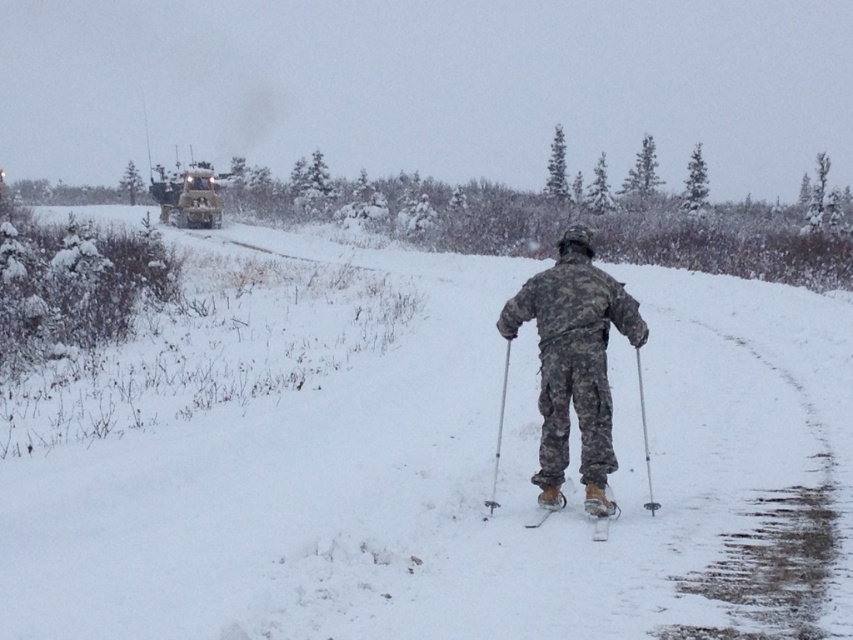
Who is lower down, camouflage fabric skier at center or metallic silver ski pole at center?

Positioned lower is metallic silver ski pole at center.

Between camouflage fabric skier at center and metallic silver ski pole at center, which one is positioned higher?

camouflage fabric skier at center is above.

Does point (611, 461) come in front of point (503, 381)?

Yes, it is.

This screenshot has height=640, width=853. In order to click on camouflage fabric skier at center in this screenshot , I will do tap(573, 364).

Who is shorter, white matte snow at center or metallic silver ski pole at center?

metallic silver ski pole at center

Is point (223, 445) closer to viewer compared to point (486, 500)?

No, (223, 445) is further to viewer.

Identify the location of white matte snow at center. (421, 460).

Who is positioned more to the right, metallic silver ski pole at center or camouflage-patterned ski at center?

camouflage-patterned ski at center is more to the right.

Image resolution: width=853 pixels, height=640 pixels. I want to click on metallic silver ski pole at center, so click(498, 436).